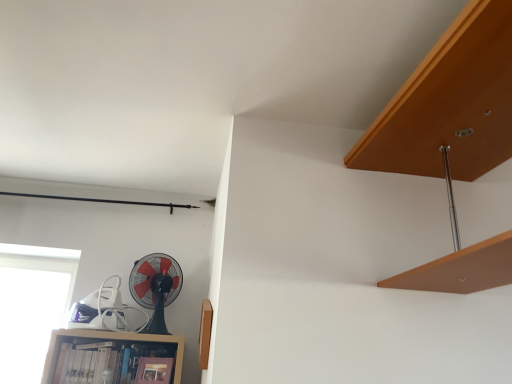
Question: From the image's perspective, is wooden bookshelf at lower left located above or below transparent glass window at lower left?

Choices:
 (A) above
 (B) below

Answer: (B)

Question: From a real-world perspective, is wooden bookshelf at lower left above or below transparent glass window at lower left?

Choices:
 (A) above
 (B) below

Answer: (B)

Question: Estimate the real-world distances between objects in this image. Which object is closer to the black plastic fan at lower left?

Choices:
 (A) wooden bookshelf at lower left
 (B) transparent glass window at lower left

Answer: (A)

Question: Considering the real-world distances, which object is closest to the transparent glass window at lower left?

Choices:
 (A) wooden bookshelf at lower left
 (B) black plastic fan at lower left

Answer: (A)